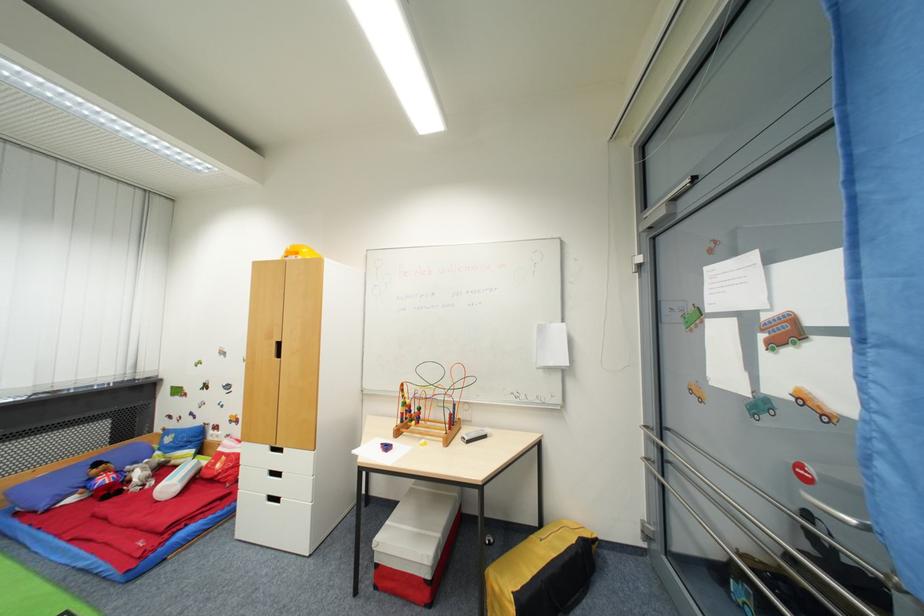
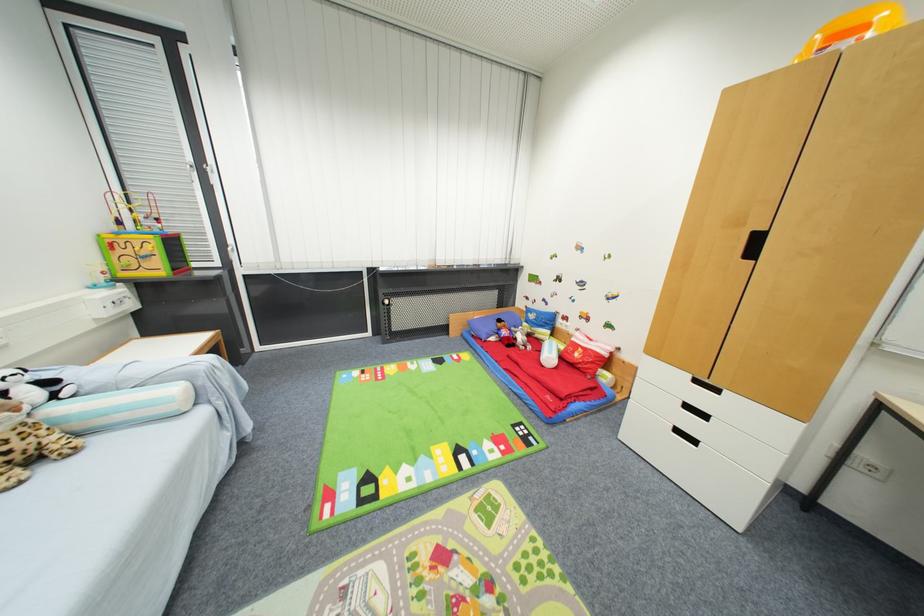
Where in the second image is the point corresponding to (x=47, y=508) from the first image?

(488, 339)